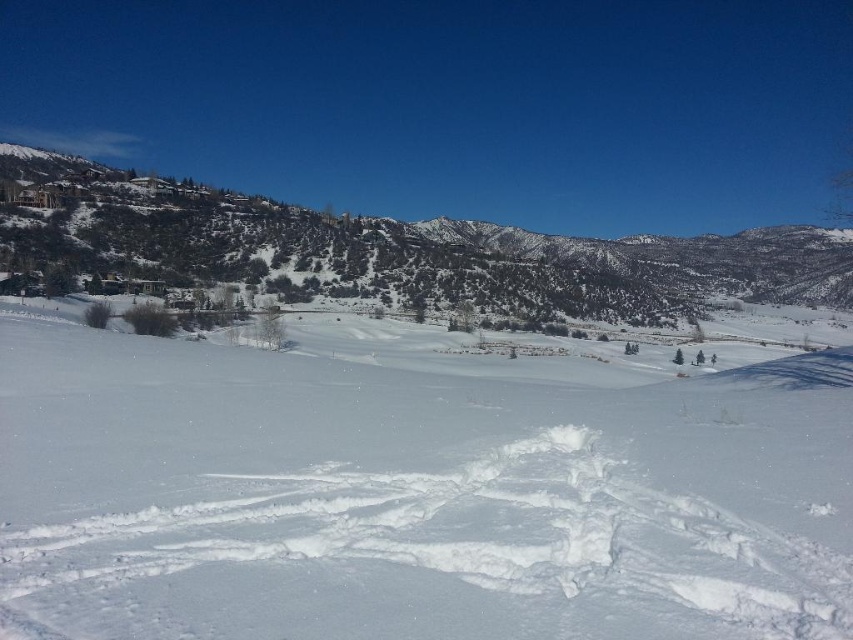
You are standing at the camera position and want to walk to both points. Which point should you reach first, point [596,524] or point [717,308]?

You will reach point [596,524] first because it is closer to the camera than point [717,308].

You are planning to build a snowman using the white fluffy snow at center and the green textured hillside at upper left. Which area has enough space to accommodate the snowman?

The green textured hillside at upper left has a greater width than the white fluffy snow at center, so it can accommodate the snowman better.